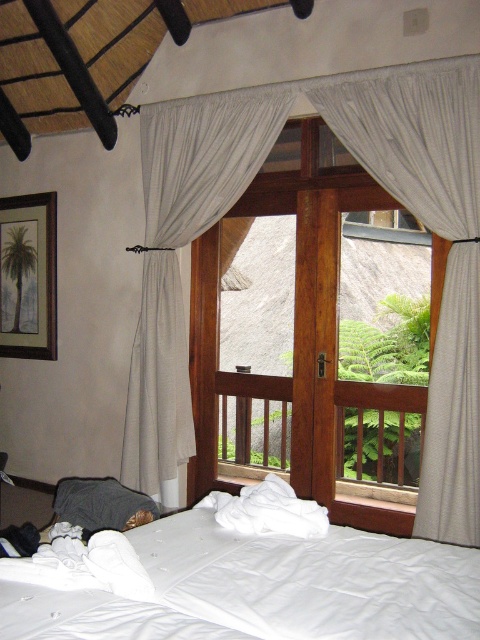
Question: Does wooden door at center have a smaller size compared to white soft bed at lower left?

Choices:
 (A) no
 (B) yes

Answer: (A)

Question: Is white textured curtain at center to the right of white sheer curtain at center from the viewer's perspective?

Choices:
 (A) yes
 (B) no

Answer: (A)

Question: Which object is closer to the camera taking this photo?

Choices:
 (A) white soft bed at lower left
 (B) white sheer curtain at center
 (C) wooden door at center

Answer: (A)

Question: Which object is positioned closest to the wooden door at center?

Choices:
 (A) white textured curtain at center
 (B) white sheer curtain at center
 (C) white soft bed at lower left

Answer: (B)

Question: Which object is the farthest from the white textured curtain at center?

Choices:
 (A) wooden door at center
 (B) white soft bed at lower left

Answer: (B)

Question: Considering the relative positions of white textured curtain at center and white sheer curtain at center in the image provided, where is white textured curtain at center located with respect to white sheer curtain at center?

Choices:
 (A) above
 (B) below

Answer: (B)